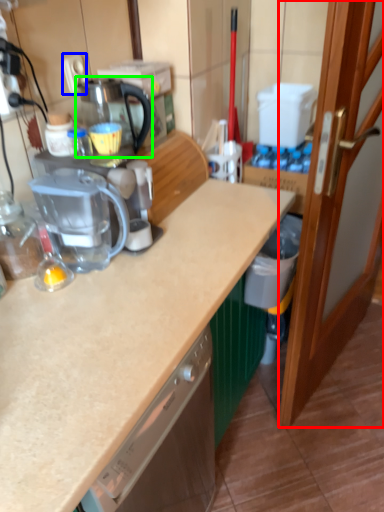
Question: Based on their relative distances, which object is nearer to door (highlighted by a red box)? Choose from electric outlet (highlighted by a blue box) and coffeepot (highlighted by a green box).

Choices:
 (A) electric outlet
 (B) coffeepot

Answer: (B)